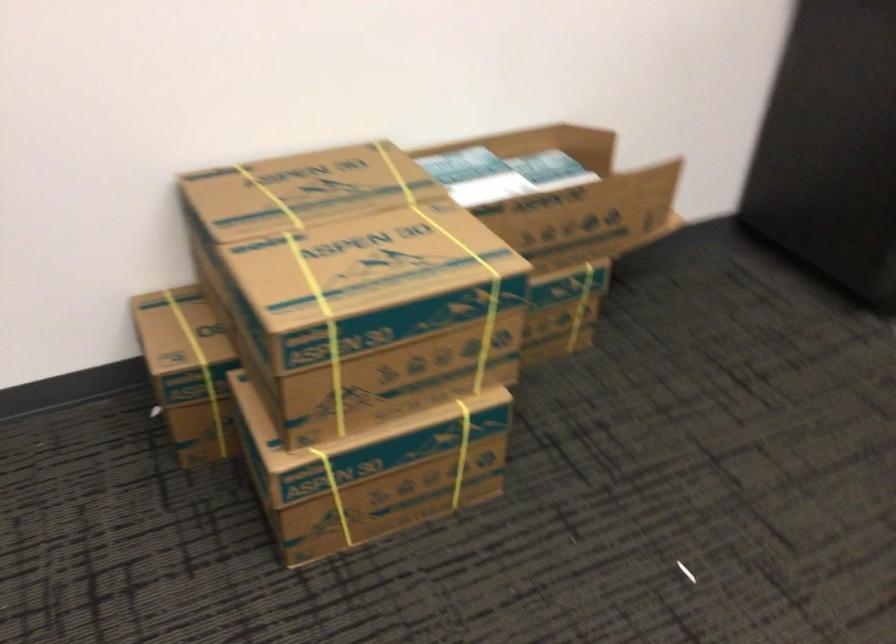
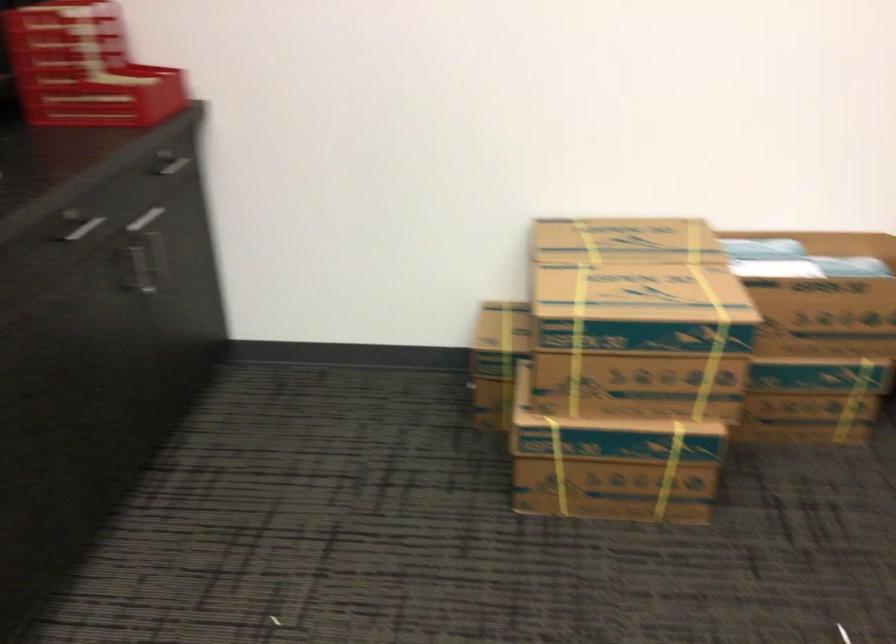
Locate, in the second image, the point that corresponds to point (549, 201) in the first image.

(828, 286)